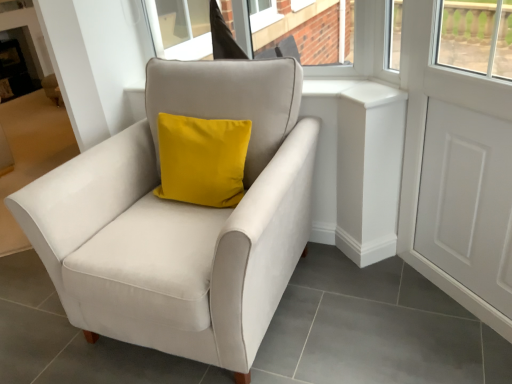
Question: Visually, is white matte screen door at right positioned to the left or to the right of satin beige armchair at center?

Choices:
 (A) right
 (B) left

Answer: (A)

Question: Considering the positions of white matte screen door at right and satin beige armchair at center in the image, is white matte screen door at right wider or thinner than satin beige armchair at center?

Choices:
 (A) thin
 (B) wide

Answer: (A)

Question: From a real-world perspective, is white matte screen door at right above or below satin beige armchair at center?

Choices:
 (A) below
 (B) above

Answer: (B)

Question: Looking at the image, does satin beige armchair at center seem bigger or smaller compared to white matte screen door at right?

Choices:
 (A) small
 (B) big

Answer: (B)

Question: Considering the relative positions of satin beige armchair at center and white matte screen door at right in the image provided, is satin beige armchair at center to the left or to the right of white matte screen door at right?

Choices:
 (A) left
 (B) right

Answer: (A)

Question: From the image's perspective, relative to white matte screen door at right, is satin beige armchair at center above or below?

Choices:
 (A) below
 (B) above

Answer: (A)

Question: Is satin beige armchair at center wider or thinner than white matte screen door at right?

Choices:
 (A) wide
 (B) thin

Answer: (A)